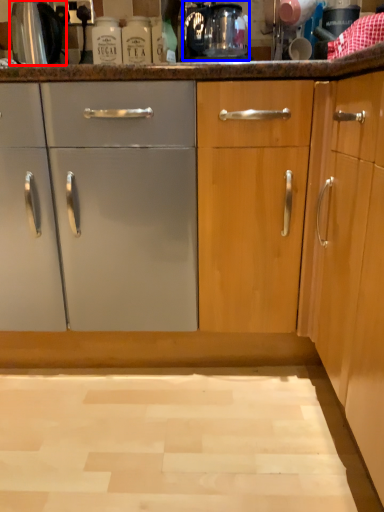
Question: Which point is further to the camera, appliance (highlighted by a red box) or coffee machine (highlighted by a blue box)?

Choices:
 (A) appliance
 (B) coffee machine

Answer: (A)